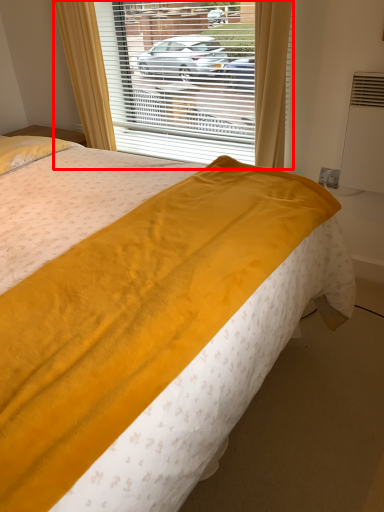
Question: From the image's perspective, considering the relative positions of window (annotated by the red box) and bed in the image provided, where is window (annotated by the red box) located with respect to the staircase?

Choices:
 (A) below
 (B) above

Answer: (B)